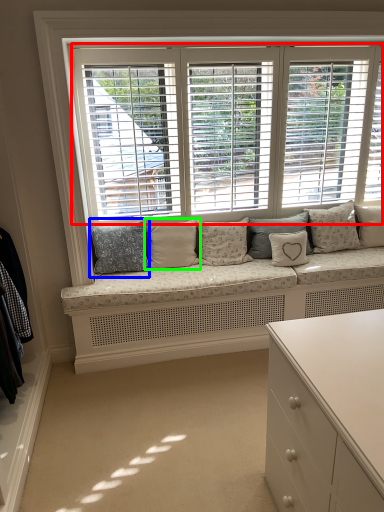
Question: Considering the real-world distances, which object is farthest from window (highlighted by a red box)? pillow (highlighted by a blue box) or pillow (highlighted by a green box)?

Choices:
 (A) pillow
 (B) pillow

Answer: (A)